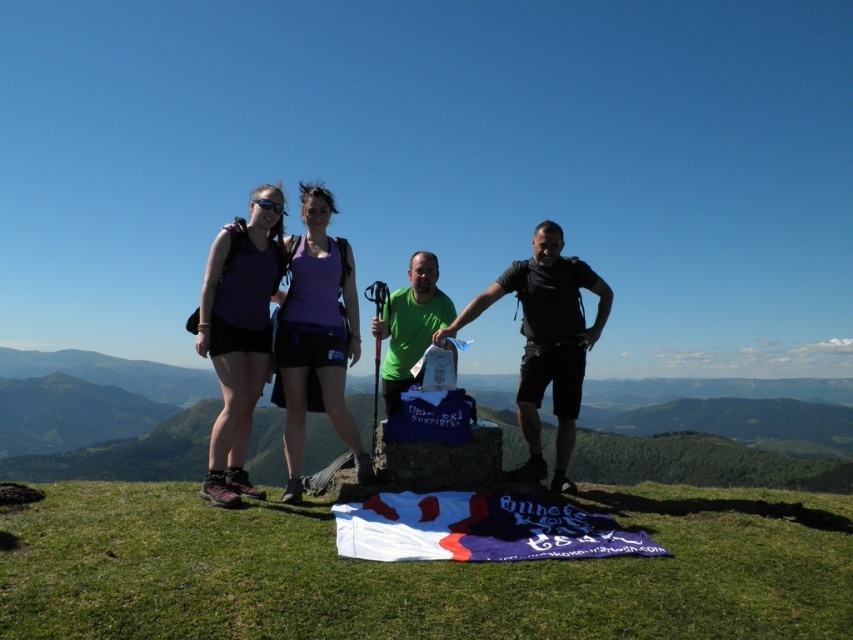
Who is positioned more to the left, purple fabric tank top at center or black matte goggles at upper center?

From the viewer's perspective, black matte goggles at upper center appears more on the left side.

The height and width of the screenshot is (640, 853). What do you see at coordinates (316, 337) in the screenshot?
I see `purple fabric tank top at center` at bounding box center [316, 337].

The width and height of the screenshot is (853, 640). Find the location of `purple fabric tank top at center`. purple fabric tank top at center is located at coordinates (316, 337).

Does black matte shirt at center have a greater height compared to black matte goggles at upper center?

Yes, black matte shirt at center is taller than black matte goggles at upper center.

This screenshot has height=640, width=853. What are the coordinates of `black matte shirt at center` in the screenshot? It's located at (546, 342).

Who is lower down, purple fabric tank top at center or matte purple shirt at left?

matte purple shirt at left

Which is above, purple fabric tank top at center or matte purple shirt at left?

Positioned higher is purple fabric tank top at center.

You are a GUI agent. You are given a task and a screenshot of the screen. Output one action in this format:
    pyautogui.click(x=<x>, y=<y>)
    Task: Click on the purple fabric tank top at center
    The image size is (853, 640).
    Given the screenshot: What is the action you would take?
    pyautogui.click(x=316, y=337)